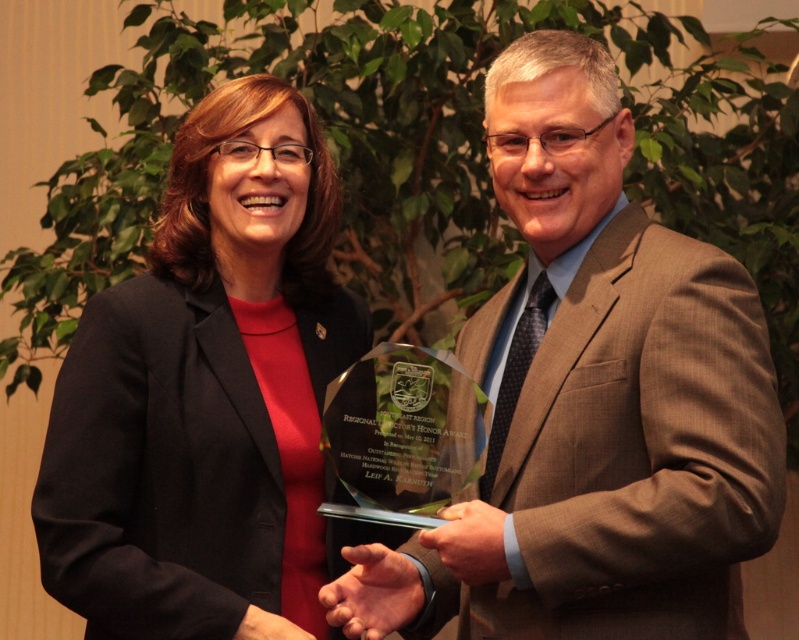
You are organizing a charity event and need to decide which of the two outfits displayed in the image can accommodate a larger decorative pin. Based on the brown textured suit at center and the matte black blazer at center, which one would be more suitable?

The brown textured suit at center has a larger size compared to the matte black blazer at center, so it would be more suitable for accommodating a larger decorative pin.